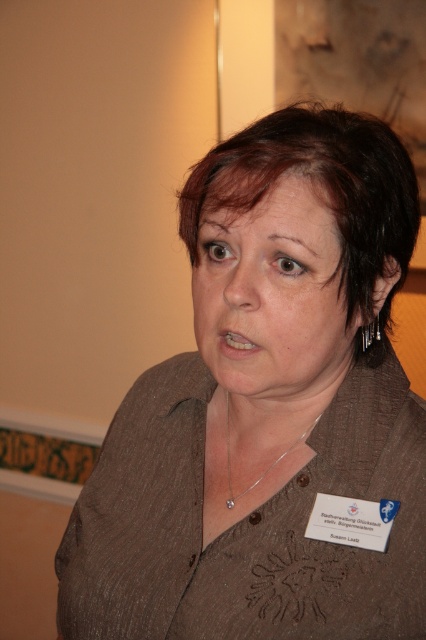
From the picture: Please look at the image of the woman in the brown button shirt. There is a point at coordinate (270, 465). What object is located at that point?

The point at coordinate (270, 465) corresponds to the silver metallic necklace at center.

What is the exact coordinate of the brown textured shirt at center?

The brown textured shirt at center is located at point (267, 408).